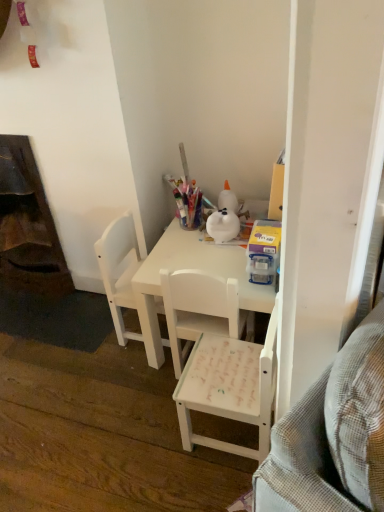
Identify the location of vacant space to the left of white matte chair at center, acting as the first chair starting from the left. (89, 336).